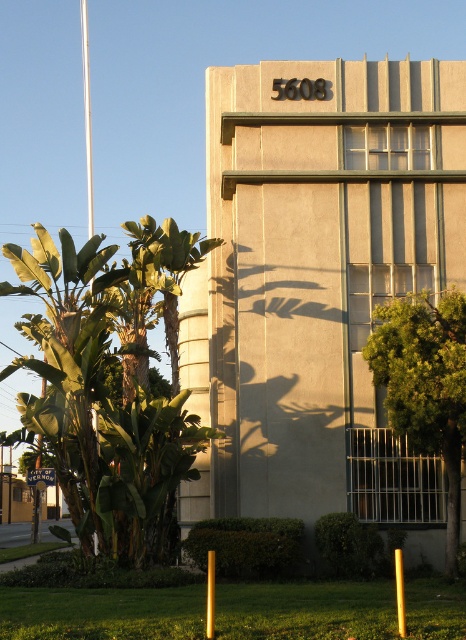
You are standing in front of the building and want to determine which object is bigger between the green leafy tree at left and the metallic pole at center. Can you tell me which one is larger?

The green leafy tree at left has a larger size compared to the metallic pole at center, so the green leafy tree at left is bigger.

Consider the image. You are standing in front of the building and want to take a photo that includes both the point at location (206, 636) and the point at (402, 600). Which point will appear larger in your photo?

Point at location (206, 636) will appear larger in the photo because it is closer to the camera than point at location (402, 600).

You are a delivery robot with a 1.2 meter wide package. You need to navigate between the green leafy tree at left and the metallic pole at center. Can you fit through the space between them?

The distance between the green leafy tree at left and the metallic pole at center is 11.90 meters. Since your package is only 1.2 meters wide, there is more than enough space to navigate through the 11.90 meter gap between them.